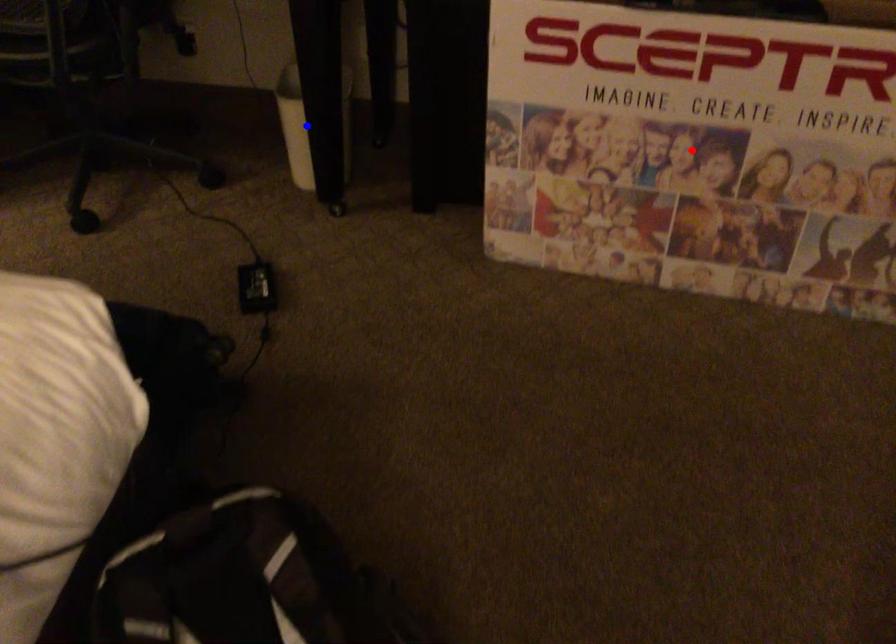
Question: Which of the two points in the image is closer to the camera?

Choices:
 (A) Blue point is closer.
 (B) Red point is closer.

Answer: (B)